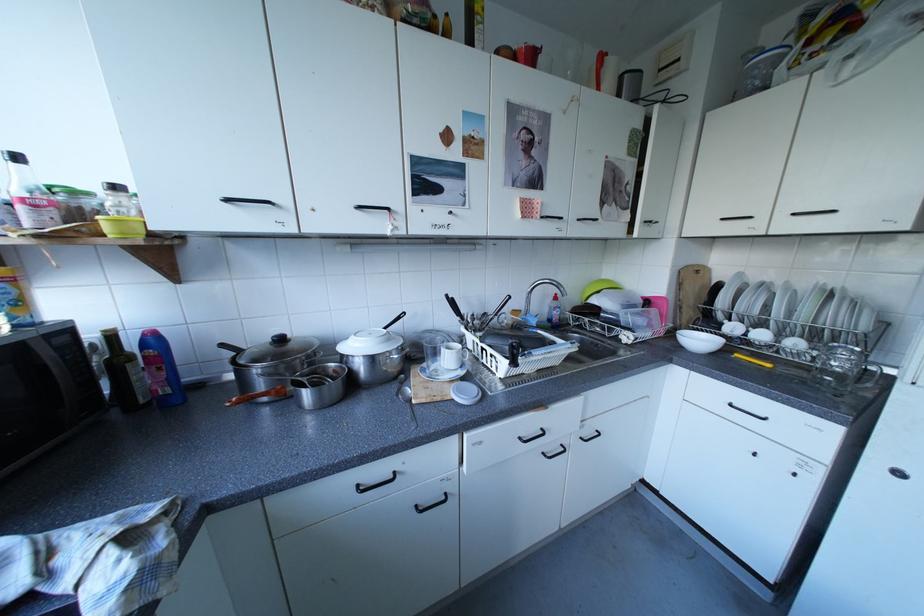
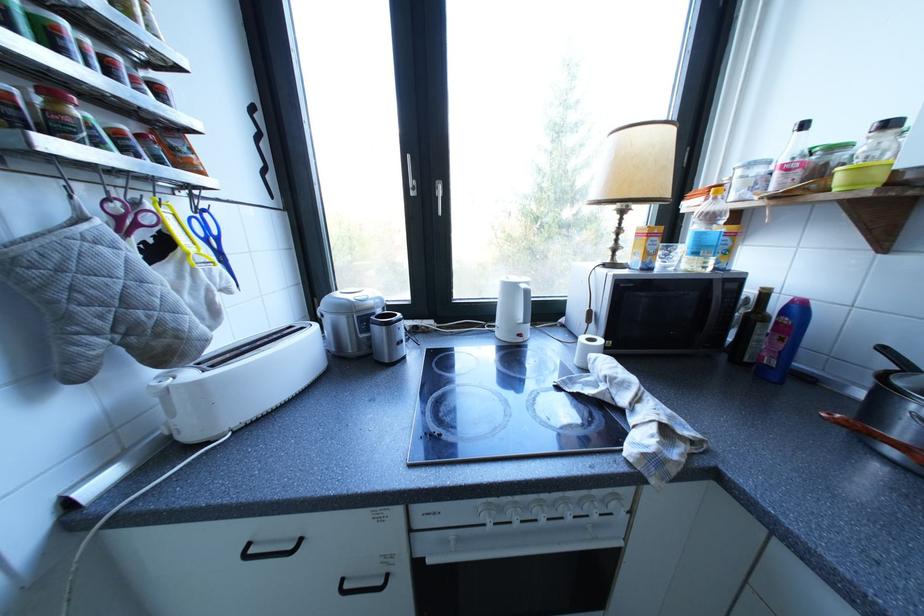
Find the pixel in the second image that matches point (277, 399) in the first image.

(907, 454)